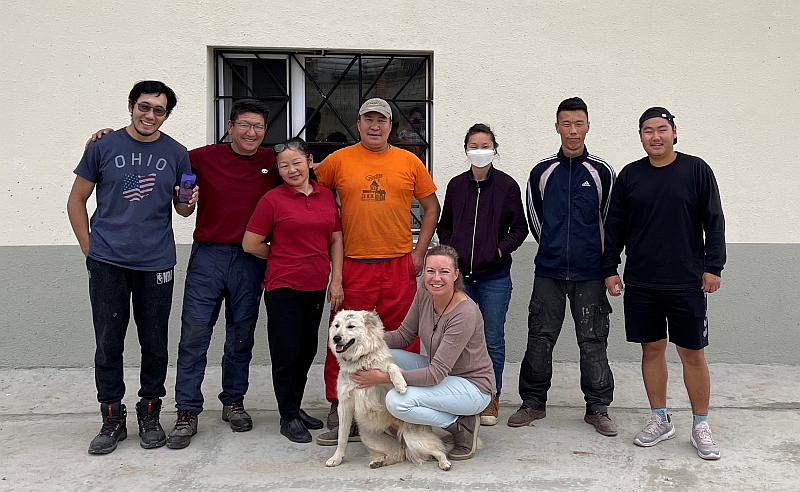
Locate an element on the screen. The image size is (800, 492). bottom of wall grey is located at coordinates (778, 300), (56, 324).